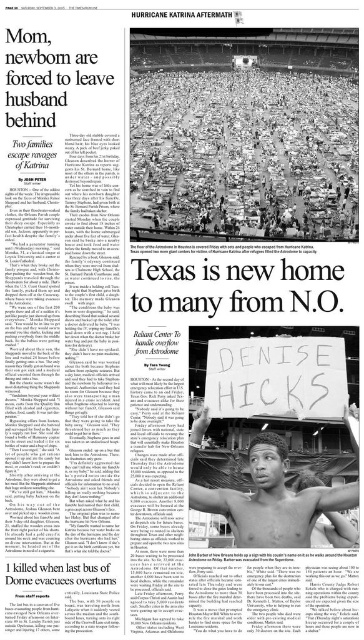
You are a journalist examining the newspaper clipping. You notice a point marked at coordinates (244, 154). Based on the scene description, can you determine what object this point is located on?

The point at coordinates (244, 154) is located on the shiny metallic sign at center.

Based on the scene described in the newspaper clipping from The Times Picayune, which object is positioned to the right of the other between the shiny metallic sign at center and the shiny black skin at center?

The shiny metallic sign at center is to the right of the shiny black skin at center.

In the newspaper clipping from The Times Picayune, there is a white paper sign at center and a shiny black skin at center. Which object is positioned to the right side?

The shiny black skin at center is to the right of the white paper sign at center.